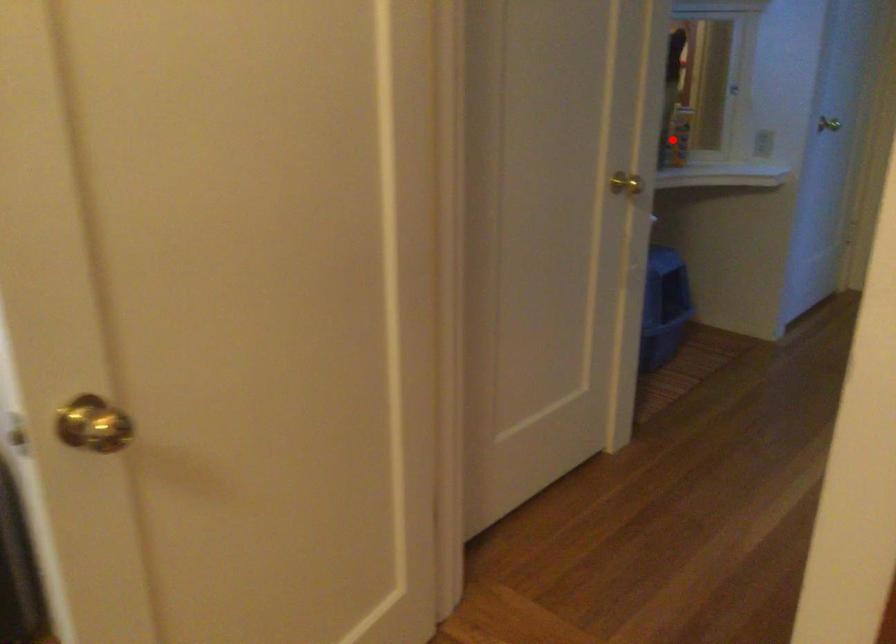
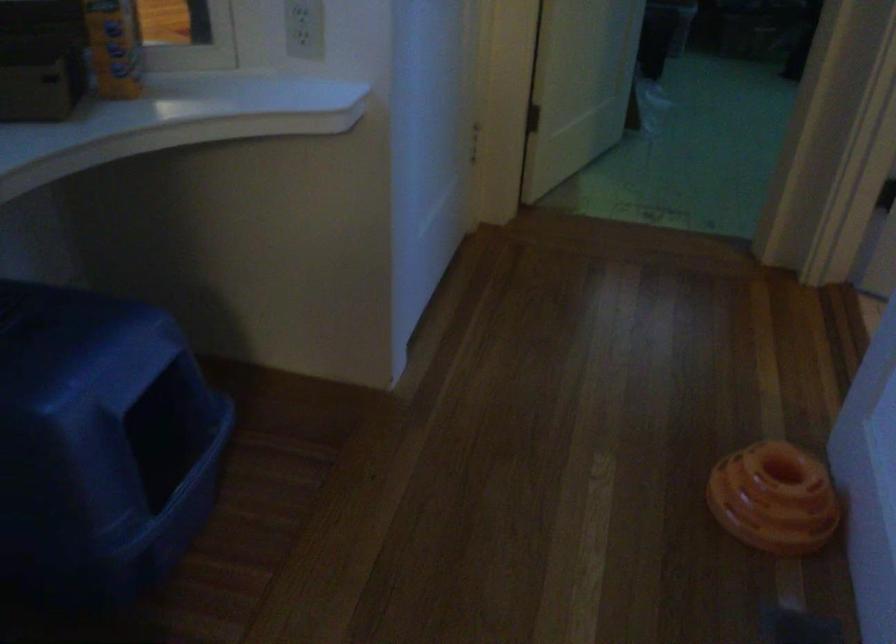
The point at the highlighted location is marked in the first image. Where is the corresponding point in the second image?

(114, 46)